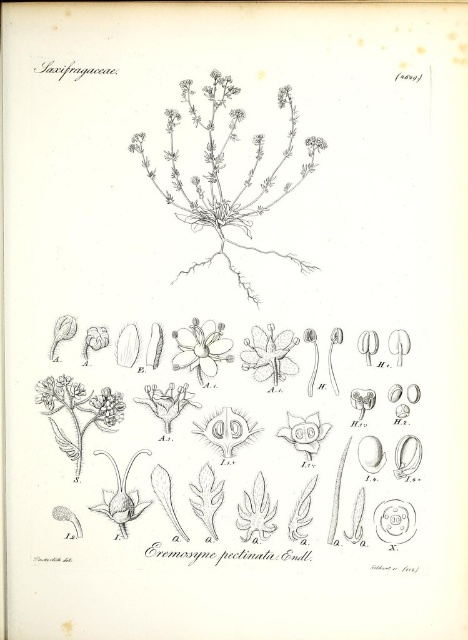
Question: Considering the real-world distances, which object is closest to the black ink flower at center?

Choices:
 (A) white paper flower at center
 (B) white delicate flower at center
 (C) translucent white flower at center

Answer: (C)

Question: Can you confirm if white paper flower at center is positioned above white delicate flower at center?

Choices:
 (A) no
 (B) yes

Answer: (B)

Question: Which object is positioned closest to the smooth white flower at center?

Choices:
 (A) white delicate flower at center
 (B) white paper flower at center
 (C) translucent white flower at center
 (D) black ink flower at center

Answer: (B)

Question: Estimate the real-world distances between objects in this image. Which object is closer to the black ink flower at center?

Choices:
 (A) white paper flower at center
 (B) smooth white flower at center

Answer: (B)

Question: Does translucent white flower at center appear under white delicate flower at center?

Choices:
 (A) yes
 (B) no

Answer: (A)

Question: Is white paper flower at center below translucent white flower at center?

Choices:
 (A) yes
 (B) no

Answer: (B)